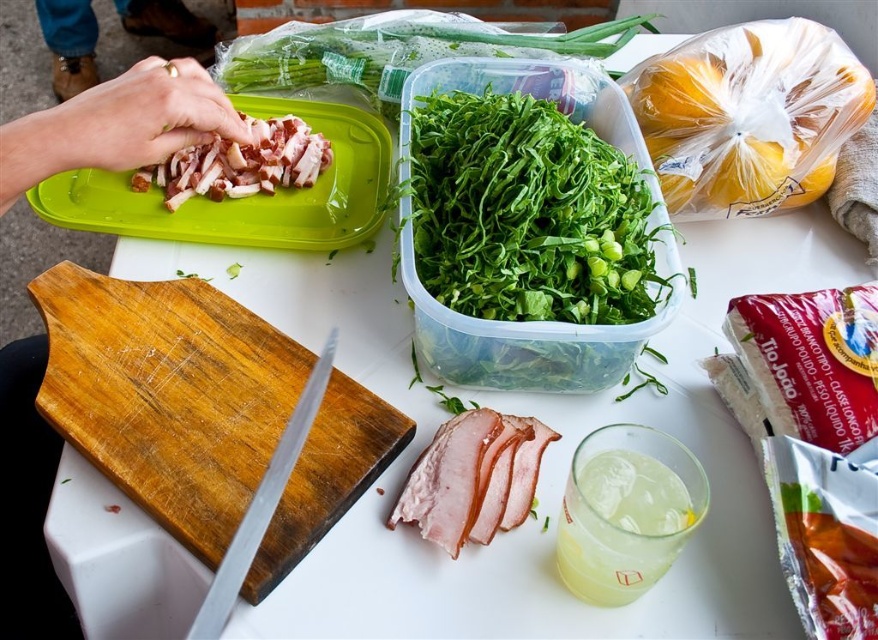
Question: Which object is the closest to the green plastic tray at upper left?

Choices:
 (A) translucent glass at lower right
 (B) gold ring at upper left

Answer: (A)

Question: Which point appears closest to the camera in this image?

Choices:
 (A) (148, 227)
 (B) (149, 513)

Answer: (B)

Question: Can you confirm if yellow plastic bag at upper right is thinner than sliced pinkish-brown meat at upper left?

Choices:
 (A) no
 (B) yes

Answer: (A)

Question: Does yellow plastic bag at upper right have a smaller size compared to translucent glass at lower right?

Choices:
 (A) yes
 (B) no

Answer: (B)

Question: Which point appears farthest from the camera in this image?

Choices:
 (A) (332, 44)
 (B) (78, 10)
 (C) (540, 355)

Answer: (B)

Question: Does green leafy vegetable at upper center appear on the right side of silver metallic knife at lower left?

Choices:
 (A) yes
 (B) no

Answer: (A)